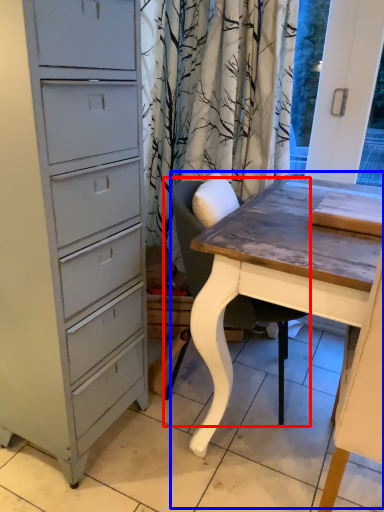
Question: Which object appears closest to the camera in this image, chair (highlighted by a red box) or table (highlighted by a blue box)?

Choices:
 (A) chair
 (B) table

Answer: (B)